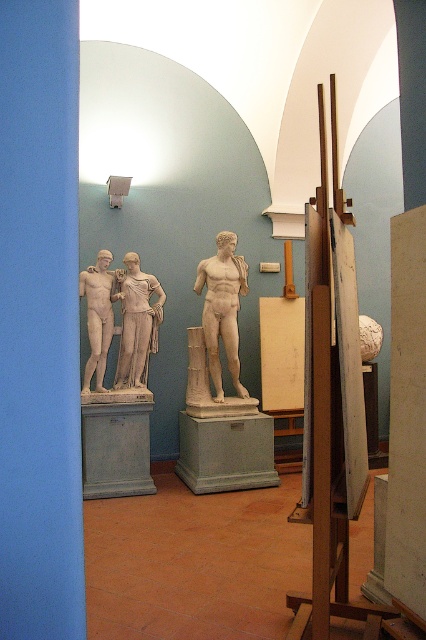
You are standing in the museum and want to take a photo of the marble statue at center. If your camera has a maximum focus range of 5 meters, will you be able to capture the statue clearly without moving closer?

The marble statue at center is 5.42 meters away from the viewer. Since the camera can only focus up to 5 meters, you will need to move closer to ensure the statue is in focus.